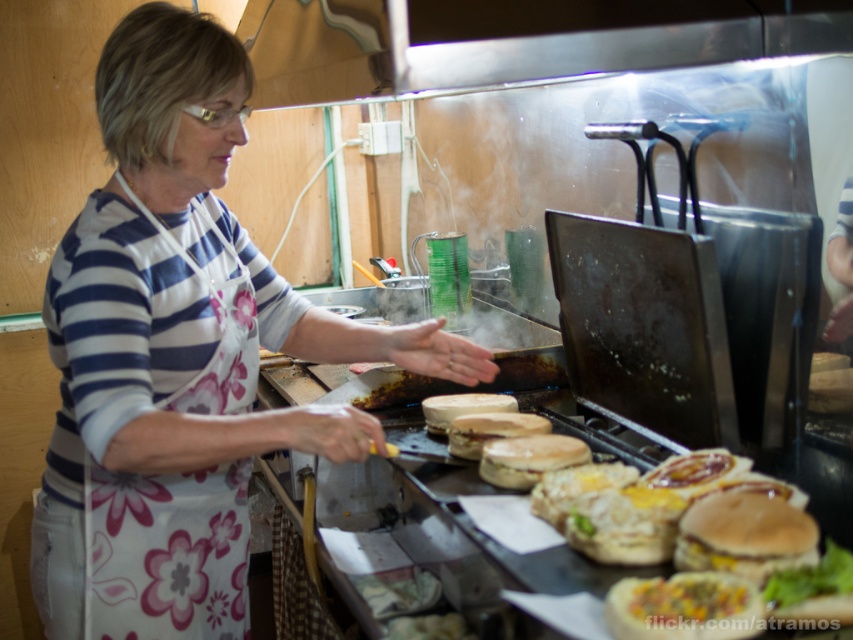
Does golden crispy burger bun at center appear under white bread at center?

Yes.

Who is lower down, golden crispy burger bun at center or white bread at center?

golden crispy burger bun at center

Which is behind, point (682, 592) or point (428, 408)?

Positioned behind is point (428, 408).

Locate an element on the screen. Image resolution: width=853 pixels, height=640 pixels. golden crispy burger bun at center is located at coordinates (683, 605).

Which is more to the right, white floral apron at center or white bread at center?

From the viewer's perspective, white bread at center appears more on the right side.

Is white floral apron at center smaller than white bread at center?

No.

Image resolution: width=853 pixels, height=640 pixels. Identify the location of white floral apron at center. (178, 355).

Is breaded golden-brown hamburger at center smaller than white bread at center?

Yes, breaded golden-brown hamburger at center is smaller than white bread at center.

Is breaded golden-brown hamburger at center to the left of white bread at center from the viewer's perspective?

Incorrect, breaded golden-brown hamburger at center is not on the left side of white bread at center.

This screenshot has height=640, width=853. What do you see at coordinates (744, 536) in the screenshot?
I see `breaded golden-brown hamburger at center` at bounding box center [744, 536].

The image size is (853, 640). In order to click on breaded golden-brown hamburger at center in this screenshot , I will do (744, 536).